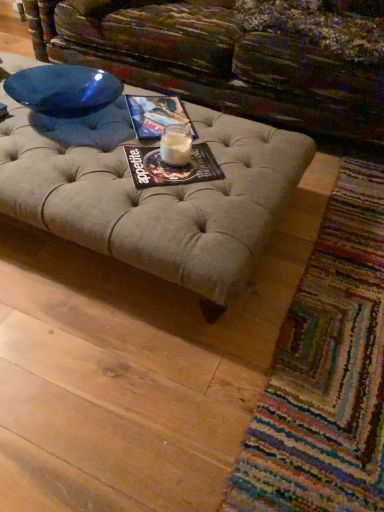
Question: In terms of width, does matte paper magazine at center, the 2th magazine when ordered from top to bottom, look wider or thinner when compared to white glass candle at center?

Choices:
 (A) thin
 (B) wide

Answer: (B)

Question: Is matte paper magazine at center, arranged as the 2th magazine when viewed from the back, bigger or smaller than white glass candle at center?

Choices:
 (A) big
 (B) small

Answer: (A)

Question: Which object is the closest to the multicolored woven mat at lower right?

Choices:
 (A) matte paper magazine at center, positioned as the second magazine in front-to-back order
 (B) matte paper magazine at center, which ranks as the first magazine in bottom-to-top order
 (C) white glass candle at center

Answer: (B)

Question: Which object is the closest to the multicolored woven mat at lower right?

Choices:
 (A) matte paper magazine at center, positioned as the second magazine in front-to-back order
 (B) matte paper magazine at center, the 1th magazine positioned from the front
 (C) white glass candle at center

Answer: (B)